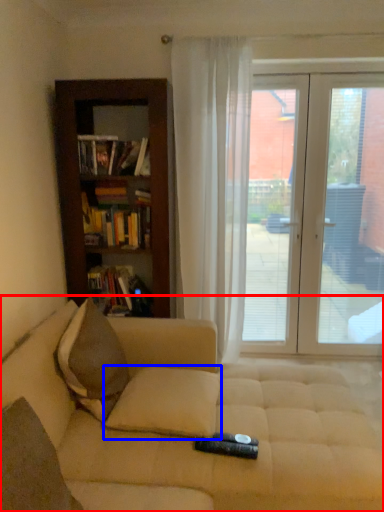
Question: Which object is further to the camera taking this photo, studio couch (highlighted by a red box) or pillow (highlighted by a blue box)?

Choices:
 (A) studio couch
 (B) pillow

Answer: (B)